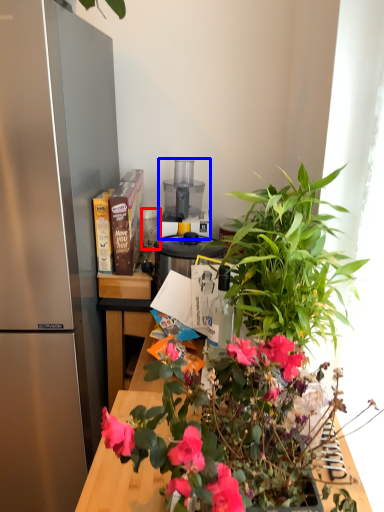
Question: Which of the following is the farthest to the observer, appliance (highlighted by a red box) or appliance (highlighted by a blue box)?

Choices:
 (A) appliance
 (B) appliance

Answer: (A)